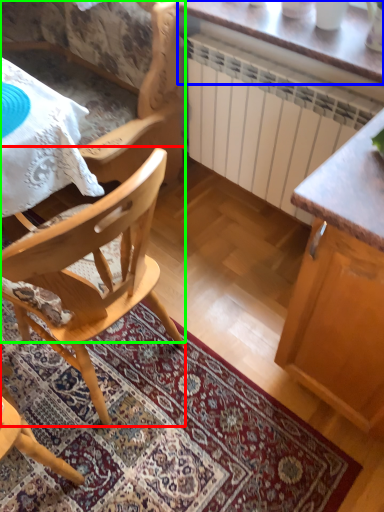
Question: Which object is positioned farthest from chair (highlighted by a red box)? Select from table (highlighted by a blue box) and chair (highlighted by a green box).

Choices:
 (A) table
 (B) chair

Answer: (A)